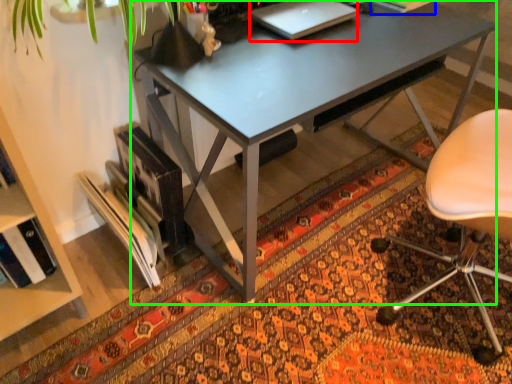
Question: Considering the real-world distances, which object is farthest from laptop (highlighted by a red box)? book (highlighted by a blue box) or desk (highlighted by a green box)?

Choices:
 (A) book
 (B) desk

Answer: (A)